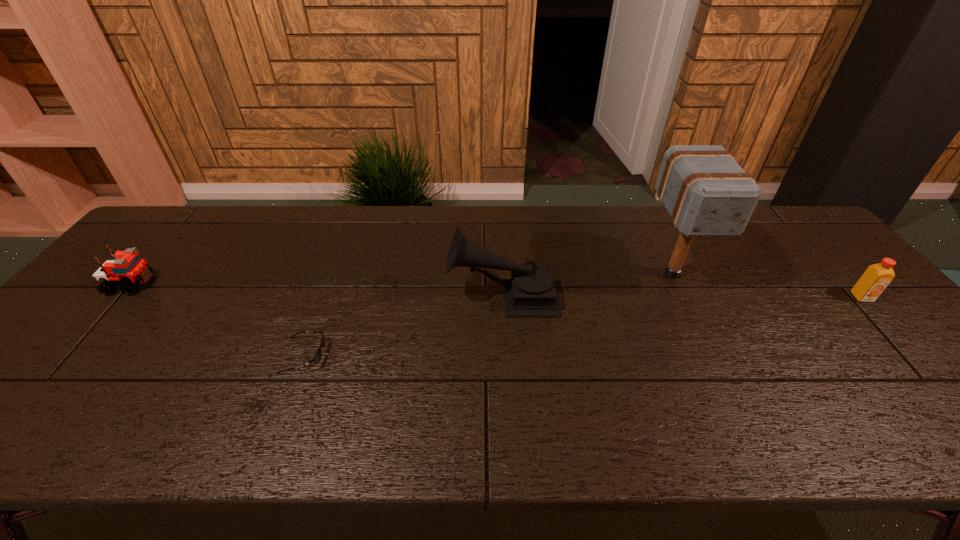
Where is `the tallest object`? the tallest object is located at coordinates (706, 192).

Locate an element on the screen. This screenshot has width=960, height=540. the fourth object from left to right is located at coordinates (706, 192).

Find the location of a particular element. The height and width of the screenshot is (540, 960). the fourth shortest object is located at coordinates (531, 291).

At what (x,y) coordinates should I click in order to perform the action: click on phonograph_record. Please return your answer as a coordinate pair (x, y). Looking at the image, I should click on (531, 291).

You are a GUI agent. You are given a task and a screenshot of the screen. Output one action in this format:
    pyautogui.click(x=<x>, y=<y>)
    Task: Click on the orange juice
    The height and width of the screenshot is (540, 960).
    Given the screenshot: What is the action you would take?
    pyautogui.click(x=875, y=279)

This screenshot has width=960, height=540. Identify the location of the leftmost object. (126, 268).

Find the location of `the nearest object`. the nearest object is located at coordinates (317, 357).

The image size is (960, 540). What are the coordinates of `the fourth object from right to left` in the screenshot? It's located at (317, 357).

This screenshot has width=960, height=540. What are the coordinates of `vacant area located 0.330m on the striking surface of the mallet` in the screenshot? It's located at (739, 414).

Locate an element on the screen. vacant space located from the horn of the phonograph_record is located at coordinates (403, 295).